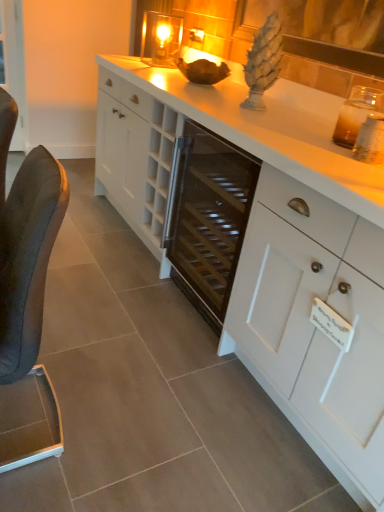
Question: Does transparent glass door at left have a larger size compared to white glossy countertop at center?

Choices:
 (A) no
 (B) yes

Answer: (A)

Question: Is transparent glass door at left far from white glossy countertop at center?

Choices:
 (A) no
 (B) yes

Answer: (B)

Question: Does transparent glass door at left appear on the right side of white glossy countertop at center?

Choices:
 (A) yes
 (B) no

Answer: (B)

Question: Is transparent glass door at left smaller than white glossy countertop at center?

Choices:
 (A) yes
 (B) no

Answer: (A)

Question: From a real-world perspective, is transparent glass door at left on white glossy countertop at center?

Choices:
 (A) no
 (B) yes

Answer: (B)

Question: Do you think white matte cabinet at center is within clear glass candle at upper center, or outside of it?

Choices:
 (A) outside
 (B) inside

Answer: (A)

Question: Considering the positions of white matte cabinet at center and clear glass candle at upper center in the image, is white matte cabinet at center wider or thinner than clear glass candle at upper center?

Choices:
 (A) wide
 (B) thin

Answer: (A)

Question: Does point (264, 344) appear closer or farther from the camera than point (150, 55)?

Choices:
 (A) farther
 (B) closer

Answer: (B)

Question: From a real-world perspective, is white matte cabinet at center above or below clear glass candle at upper center?

Choices:
 (A) below
 (B) above

Answer: (A)

Question: From a real-world perspective, is clear glass candle at upper center above or below white glossy countertop at center?

Choices:
 (A) below
 (B) above

Answer: (B)

Question: Is clear glass candle at upper center to the left or to the right of white glossy countertop at center in the image?

Choices:
 (A) left
 (B) right

Answer: (A)

Question: Looking at their shapes, would you say clear glass candle at upper center is wider or thinner than white glossy countertop at center?

Choices:
 (A) thin
 (B) wide

Answer: (A)

Question: From the image's perspective, is clear glass candle at upper center located above or below white glossy countertop at center?

Choices:
 (A) below
 (B) above

Answer: (B)

Question: From the image's perspective, is black leather chair at left located above or below clear glass candle at upper center?

Choices:
 (A) below
 (B) above

Answer: (A)

Question: Considering the positions of point (11, 348) and point (173, 15), is point (11, 348) closer or farther from the camera than point (173, 15)?

Choices:
 (A) closer
 (B) farther

Answer: (A)